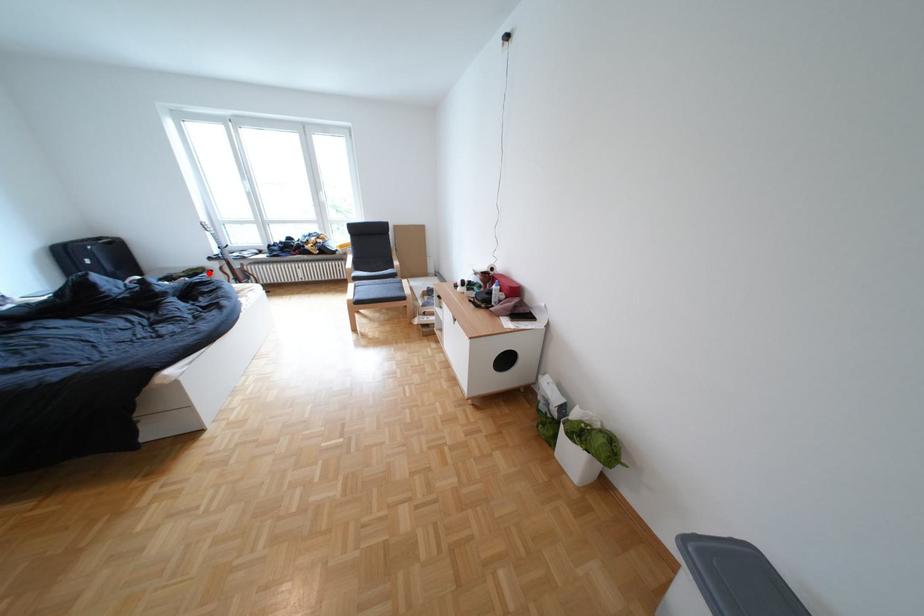
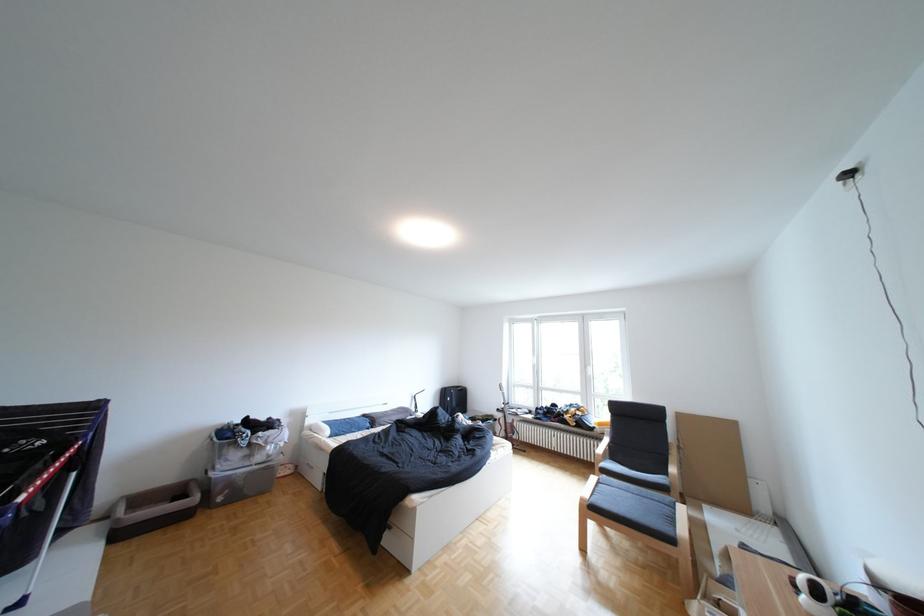
Where in the second image is the point corresponding to the highlighted location from the first image?

(502, 419)